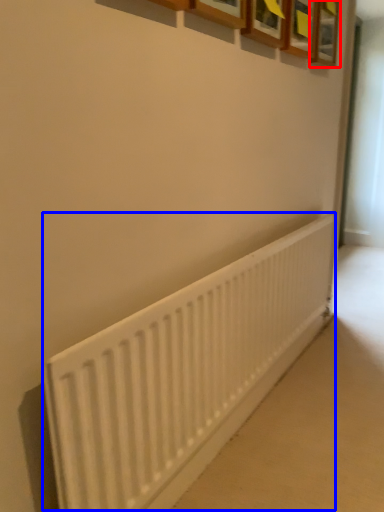
Question: Which point is further to the camera, picture frame (highlighted by a red box) or radiator (highlighted by a blue box)?

Choices:
 (A) picture frame
 (B) radiator

Answer: (A)